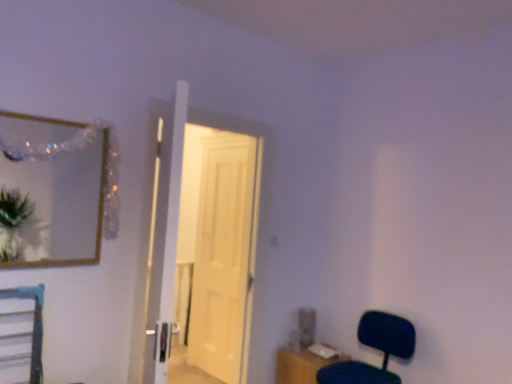
Question: From the image's perspective, relative to matte black chair at lower right, is wooden frame mirror at upper left above or below?

Choices:
 (A) below
 (B) above

Answer: (B)

Question: Considering their positions, is wooden frame mirror at upper left located in front of or behind matte black chair at lower right?

Choices:
 (A) front
 (B) behind

Answer: (A)

Question: Considering the real-world distances, which object is closest to the white glossy door at center, the 2th door positioned from the front?

Choices:
 (A) wooden table at lower right
 (B) matte black chair at lower right
 (C) wooden frame mirror at upper left
 (D) white wooden door at center, which appears as the first door when viewed from the front

Answer: (D)

Question: Which of these objects is positioned farthest from the wooden frame mirror at upper left?

Choices:
 (A) matte black chair at lower right
 (B) white glossy door at center, which ranks as the 1th door in back-to-front order
 (C) white wooden door at center, the second door from the back
 (D) wooden table at lower right

Answer: (A)